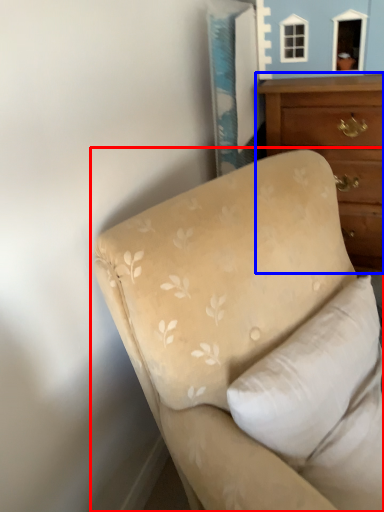
Question: Which object is further to the camera taking this photo, studio couch (highlighted by a red box) or chest of drawers (highlighted by a blue box)?

Choices:
 (A) studio couch
 (B) chest of drawers

Answer: (B)